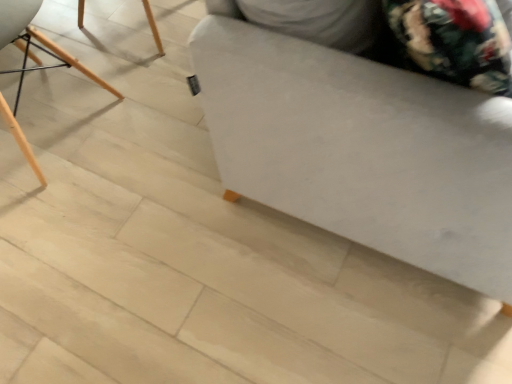
The width and height of the screenshot is (512, 384). What are the coordinates of `free point below wooden chair at left (from a real-world perspective)` in the screenshot? It's located at (58, 119).